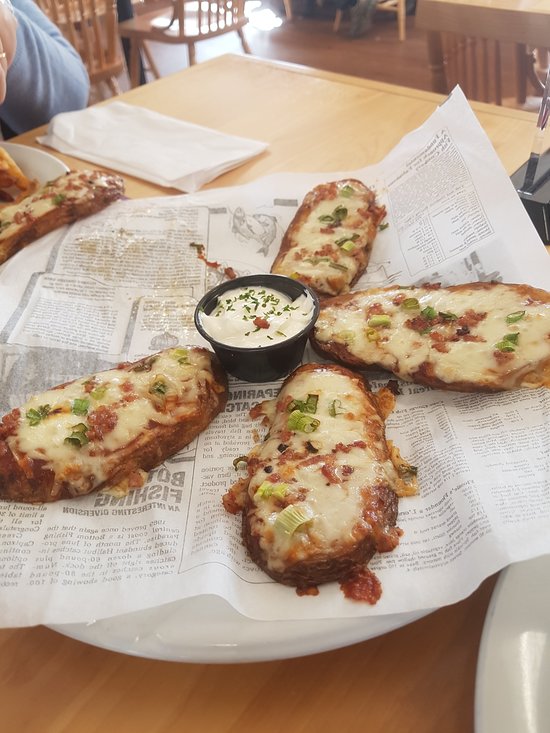
This screenshot has height=733, width=550. I want to click on table surface at bottom of image, so click(168, 704).